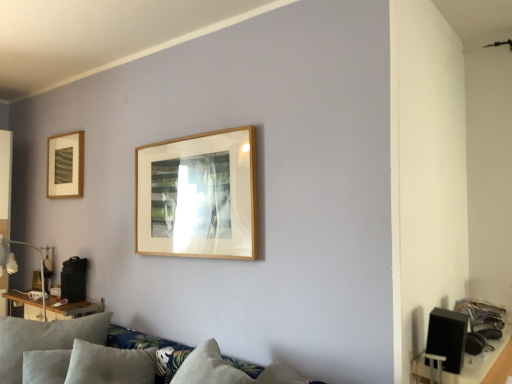
Measure the distance between point (8,247) and camera.

They are 12.82 feet apart.

This screenshot has height=384, width=512. Describe the element at coordinates (447, 337) in the screenshot. I see `black matte speaker at lower right` at that location.

This screenshot has width=512, height=384. I want to click on matte gold picture frame at upper left, so [x=65, y=165].

Is point (452, 334) closer or farther from the camera than point (44, 297)?

Point (452, 334) appears to be closer to the viewer than point (44, 297).

You are a GUI agent. You are given a task and a screenshot of the screen. Output one action in this format:
    pyautogui.click(x=<x>, y=<y>)
    Task: Click on the speaker that appears on the right of matte white lamp at left
    This screenshot has width=512, height=384.
    Given the screenshot: What is the action you would take?
    pyautogui.click(x=447, y=337)

From a real-world perspective, is black matte speaker at lower right under matte white lamp at left?

Yes.

From the image's perspective, which is below, black matte speaker at lower right or matte white lamp at left?

black matte speaker at lower right is shown below in the image.

From the picture: Considering the sizes of objects wooden table at left and soft gray fabric couch at lower left in the image provided, who is bigger, wooden table at left or soft gray fabric couch at lower left?

With larger size is soft gray fabric couch at lower left.

Is wooden table at left not near soft gray fabric couch at lower left?

That's not correct — wooden table at left is a little close to soft gray fabric couch at lower left.

How much distance is there between wooden table at left and soft gray fabric couch at lower left?

The distance of wooden table at left from soft gray fabric couch at lower left is 21.11 inches.

Considering the sizes of wooden table at left and soft gray fabric couch at lower left in the image, is wooden table at left wider or thinner than soft gray fabric couch at lower left?

Clearly, wooden table at left has less width compared to soft gray fabric couch at lower left.

Considering their positions, is soft gray fabric couch at lower left located in front of or behind matte white lamp at left?

Clearly, soft gray fabric couch at lower left is in front of matte white lamp at left.

Consider the image. Which is more to the right, soft gray fabric couch at lower left or matte white lamp at left?

soft gray fabric couch at lower left is more to the right.

Measure the distance from soft gray fabric couch at lower left to matte white lamp at left.

soft gray fabric couch at lower left and matte white lamp at left are 1.24 meters apart.

Which object is wider, soft gray fabric couch at lower left or matte white lamp at left?

soft gray fabric couch at lower left.

Is suede-like gray pillow at lower left next to soft gray fabric couch at lower left and touching it?

No, suede-like gray pillow at lower left is not next to soft gray fabric couch at lower left.

Considering the relative sizes of suede-like gray pillow at lower left and soft gray fabric couch at lower left in the image provided, is suede-like gray pillow at lower left smaller than soft gray fabric couch at lower left?

Correct, suede-like gray pillow at lower left occupies less space than soft gray fabric couch at lower left.

Which is behind, point (108, 315) or point (239, 363)?

The point (108, 315) is behind.

Which is behind, suede-like gray pillow at lower left or soft gray fabric couch at lower left?

suede-like gray pillow at lower left is further away from the camera.

Where is `pillow that appears below the black matte speaker at lower right (from the image's perspective)`? This screenshot has width=512, height=384. pillow that appears below the black matte speaker at lower right (from the image's perspective) is located at coordinates (44, 339).

Can you tell me how much black matte speaker at lower right and suede-like gray pillow at lower left differ in facing direction?

black matte speaker at lower right and suede-like gray pillow at lower left are facing 58.1 degrees away from each other.

Would you say suede-like gray pillow at lower left is part of black matte speaker at lower right's contents?

No, black matte speaker at lower right does not contain suede-like gray pillow at lower left.

From the picture: From a real-world perspective, is black matte speaker at lower right physically above suede-like gray pillow at lower left?

Indeed, from a real-world perspective, black matte speaker at lower right stands above suede-like gray pillow at lower left.

How many degrees apart are the facing directions of matte white lamp at left and soft gray fabric couch at lower left?

1.19 degrees.

Considering the sizes of matte white lamp at left and soft gray fabric couch at lower left in the image, is matte white lamp at left wider or thinner than soft gray fabric couch at lower left?

Clearly, matte white lamp at left has less width compared to soft gray fabric couch at lower left.

In the scene shown: Are matte white lamp at left and soft gray fabric couch at lower left making contact?

No, matte white lamp at left is not beside soft gray fabric couch at lower left.

Based on the photo, is matte white lamp at left further to the viewer compared to soft gray fabric couch at lower left?

That is True.

In the scene shown: Are wooden table at left and suede-like gray pillow at lower left far apart?

wooden table at left is actually quite close to suede-like gray pillow at lower left.

Is wooden table at left facing away from suede-like gray pillow at lower left?

That's not correct — wooden table at left is not looking away from suede-like gray pillow at lower left.

From a real-world perspective, is wooden table at left positioned under suede-like gray pillow at lower left based on gravity?

Actually, wooden table at left is physically above suede-like gray pillow at lower left in the real world.

Considering their positions, is wooden table at left located in front of or behind suede-like gray pillow at lower left?

Clearly, wooden table at left is behind suede-like gray pillow at lower left.

Locate an element on the screen. This screenshot has width=512, height=384. speaker that appears in front of the matte white lamp at left is located at coordinates (447, 337).

The width and height of the screenshot is (512, 384). I want to click on table above the soft gray fabric couch at lower left (from a real-world perspective), so tap(70, 309).

Based on their spatial positions, is soft gray fabric couch at lower left or matte gold picture frame at upper left closer to black matte speaker at lower right?

soft gray fabric couch at lower left is closer to black matte speaker at lower right.

From the image, which object appears to be farther from matte gold picture frame at upper left, soft gray fabric couch at lower left or black matte speaker at lower right?

black matte speaker at lower right lies further to matte gold picture frame at upper left than the other object.

Based on their spatial positions, is matte white lamp at left or soft gray fabric couch at lower left further from suede-like gray pillow at lower left?

The object further to suede-like gray pillow at lower left is matte white lamp at left.

Looking at the image, which one is located closer to black matte speaker at lower right, matte white lamp at left or soft gray fabric couch at lower left?

soft gray fabric couch at lower left is closer to black matte speaker at lower right.

Considering their positions, is matte gold picture frame at upper left positioned closer to matte white lamp at left than suede-like gray pillow at lower left?

Based on the image, matte gold picture frame at upper left appears to be nearer to matte white lamp at left.

Based on the photo, based on their spatial positions, is black matte speaker at lower right or wooden table at left further from matte gold picture frame at upper left?

Among the two, black matte speaker at lower right is located further to matte gold picture frame at upper left.

When comparing their distances from black matte speaker at lower right, does matte white lamp at left or wooden table at left seem further?

matte white lamp at left lies further to black matte speaker at lower right than the other object.

Consider the image. Based on their spatial positions, is wooden table at left or matte gold picture frame at upper left further from suede-like gray pillow at lower left?

matte gold picture frame at upper left is further to suede-like gray pillow at lower left.

Identify the location of lamp between wooden table at left and black matte speaker at lower right from left to right. (17, 266).

The height and width of the screenshot is (384, 512). I want to click on lamp between matte gold picture frame at upper left and wooden table at left vertically, so click(x=17, y=266).

The height and width of the screenshot is (384, 512). I want to click on table positioned between soft gray fabric couch at lower left and matte gold picture frame at upper left from near to far, so click(x=70, y=309).

The height and width of the screenshot is (384, 512). Find the location of `pillow positioned between soft gray fabric couch at lower left and matte gold picture frame at upper left from near to far`. pillow positioned between soft gray fabric couch at lower left and matte gold picture frame at upper left from near to far is located at coordinates (44, 339).